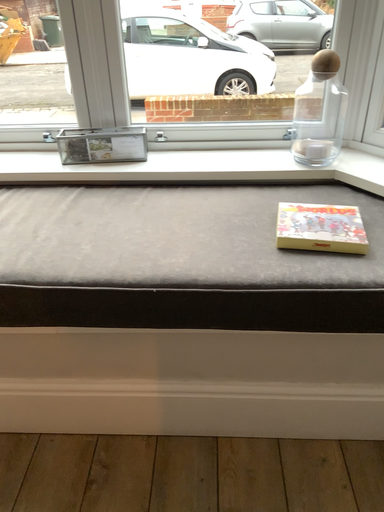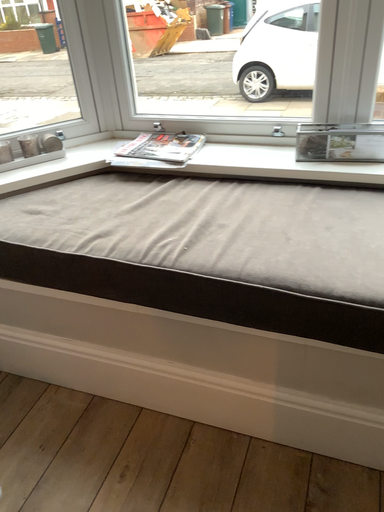
Question: How did the camera likely rotate when shooting the video?

Choices:
 (A) rotated left
 (B) rotated right

Answer: (A)